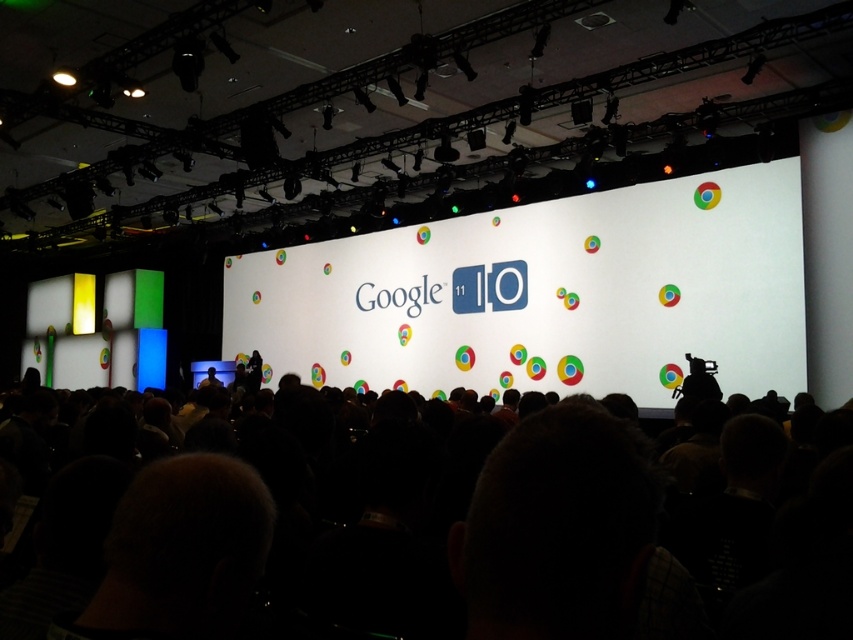
Question: Estimate the real-world distances between objects in this image. Which object is farther from the white paper at center?

Choices:
 (A) dark blue fabric at center
 (B) black matte crowd at center

Answer: (B)

Question: Observing the image, what is the correct spatial positioning of black matte crowd at center in reference to dark blue fabric at center?

Choices:
 (A) below
 (B) above

Answer: (B)

Question: Does white paper at center have a smaller size compared to dark blue fabric at center?

Choices:
 (A) yes
 (B) no

Answer: (B)

Question: Which of the following is the farthest from the observer?

Choices:
 (A) (314, 355)
 (B) (693, 513)
 (C) (213, 385)

Answer: (A)

Question: Estimate the real-world distances between objects in this image. Which object is farther from the white paper at center?

Choices:
 (A) black matte crowd at center
 (B) dark blue fabric at center

Answer: (A)

Question: Can you confirm if black matte crowd at center is positioned below dark blue fabric at center?

Choices:
 (A) yes
 (B) no

Answer: (B)